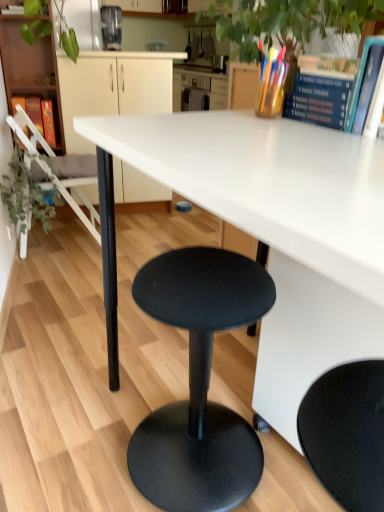
At what (x,y) coordinates should I click in order to perform the action: click on blue hardcover book at upper right, the 1th book viewed from the front. Please return your answer as a coordinate pair (x, y). The height and width of the screenshot is (512, 384). Looking at the image, I should click on (364, 84).

Find the location of a particular element. blue hardcover book at upper right, the second book in the front-to-back sequence is located at coordinates (318, 100).

The width and height of the screenshot is (384, 512). Identify the location of matte wood bookshelf at left. (30, 68).

You are a GUI agent. You are given a task and a screenshot of the screen. Output one action in this format:
    pyautogui.click(x=<x>, y=<y>)
    Task: Click on the hardcover book at left, acting as the first book starting from the top
    This screenshot has width=384, height=512.
    Given the screenshot: What is the action you would take?
    pyautogui.click(x=30, y=110)

Where is `satin silver coffee maker at upper left, the second appliance from the right`? satin silver coffee maker at upper left, the second appliance from the right is located at coordinates (85, 22).

Measure the distance between satin silver coffee maker at upper left, placed as the 1th appliance when sorted from left to right, and camera.

They are 8.23 feet apart.

The height and width of the screenshot is (512, 384). Find the location of `green leafy plant at left`. green leafy plant at left is located at coordinates (27, 196).

At what (x,y) coordinates should I click in order to perform the action: click on metallic gray coffee machine at upper center, which appears as the second appliance when viewed from the left. Please return your answer as a coordinate pair (x, y). This screenshot has width=384, height=512. Looking at the image, I should click on (111, 27).

Considering the relative sizes of metallic gray coffee machine at upper center, the first appliance in the right-to-left sequence, and white plastic chair at left in the image provided, is metallic gray coffee machine at upper center, the first appliance in the right-to-left sequence, smaller than white plastic chair at left?

Yes, metallic gray coffee machine at upper center, the first appliance in the right-to-left sequence, is smaller than white plastic chair at left.

Would you say metallic gray coffee machine at upper center, which appears as the second appliance when viewed from the left, is outside white plastic chair at left?

Yes, metallic gray coffee machine at upper center, which appears as the second appliance when viewed from the left, is outside of white plastic chair at left.

From the image's perspective, which one is positioned lower, metallic gray coffee machine at upper center, which appears as the second appliance when viewed from the left, or white plastic chair at left?

white plastic chair at left.

Can you tell me how much metallic gray coffee machine at upper center, the first appliance in the right-to-left sequence, and white plastic chair at left differ in facing direction?

The angular difference between metallic gray coffee machine at upper center, the first appliance in the right-to-left sequence, and white plastic chair at left is 1.62 degrees.

Can you confirm if satin silver coffee maker at upper left, placed as the 1th appliance when sorted from left to right, is bigger than white matte desk at center?

Incorrect, satin silver coffee maker at upper left, placed as the 1th appliance when sorted from left to right, is not larger than white matte desk at center.

Is satin silver coffee maker at upper left, the second appliance from the right, wider or thinner than white matte desk at center?

In the image, satin silver coffee maker at upper left, the second appliance from the right, appears to be more narrow than white matte desk at center.

Does satin silver coffee maker at upper left, the second appliance from the right, appear on the left side of white matte desk at center?

Yes.

Is point (71, 16) closer or farther from the camera than point (378, 298)?

Point (71, 16) is positioned farther from the camera compared to point (378, 298).

This screenshot has height=512, width=384. What are the coordinates of `plant that appears below the satin silver coffee maker at upper left, the second appliance from the right (from a real-world perspective)` in the screenshot? It's located at (27, 196).

Visually, is green leafy plant at left positioned to the left or to the right of satin silver coffee maker at upper left, the second appliance from the right?

From the image, it's evident that green leafy plant at left is to the left of satin silver coffee maker at upper left, the second appliance from the right.

From a real-world perspective, is green leafy plant at left located higher than satin silver coffee maker at upper left, placed as the 1th appliance when sorted from left to right?

No.

What's the angular difference between green leafy plant at left and satin silver coffee maker at upper left, placed as the 1th appliance when sorted from left to right,'s facing directions?

The angular difference between green leafy plant at left and satin silver coffee maker at upper left, placed as the 1th appliance when sorted from left to right, is 1.98 degrees.

Is metallic gray coffee machine at upper center, which appears as the second appliance when viewed from the left, completely or partially outside of blue hardcover book at upper right, which is the 2th book from back to front?

Yes, metallic gray coffee machine at upper center, which appears as the second appliance when viewed from the left, is not within blue hardcover book at upper right, which is the 2th book from back to front.

From a real-world perspective, is metallic gray coffee machine at upper center, which appears as the second appliance when viewed from the left, located beneath blue hardcover book at upper right, the second book in the front-to-back sequence?

Actually, metallic gray coffee machine at upper center, which appears as the second appliance when viewed from the left, is physically above blue hardcover book at upper right, the second book in the front-to-back sequence, in the real world.

Looking at the image, does metallic gray coffee machine at upper center, the first appliance in the right-to-left sequence, seem bigger or smaller compared to blue hardcover book at upper right, placed as the second book when sorted from left to right?

metallic gray coffee machine at upper center, the first appliance in the right-to-left sequence, is bigger than blue hardcover book at upper right, placed as the second book when sorted from left to right.

Where is `the 1st appliance counting from the left side of the blue hardcover book at upper right, the second book in the front-to-back sequence`? The height and width of the screenshot is (512, 384). the 1st appliance counting from the left side of the blue hardcover book at upper right, the second book in the front-to-back sequence is located at coordinates (111, 27).

Between blue hardcover book at upper right, the 2th book in the top-to-bottom sequence, and satin silver coffee maker at upper left, the second appliance from the right, which one has smaller width?

Thinner between the two is blue hardcover book at upper right, the 2th book in the top-to-bottom sequence.

Is blue hardcover book at upper right, which is the second book from bottom to top, in contact with satin silver coffee maker at upper left, the second appliance from the right?

No, blue hardcover book at upper right, which is the second book from bottom to top, is not touching satin silver coffee maker at upper left, the second appliance from the right.

From a real-world perspective, is blue hardcover book at upper right, the 2th book in the top-to-bottom sequence, above or below satin silver coffee maker at upper left, placed as the 1th appliance when sorted from left to right?

From a real-world perspective, blue hardcover book at upper right, the 2th book in the top-to-bottom sequence, is physically below satin silver coffee maker at upper left, placed as the 1th appliance when sorted from left to right.

Considering the relative sizes of blue hardcover book at upper right, which is counted as the first book, starting from the right, and satin silver coffee maker at upper left, placed as the 1th appliance when sorted from left to right, in the image provided, is blue hardcover book at upper right, which is counted as the first book, starting from the right, smaller than satin silver coffee maker at upper left, placed as the 1th appliance when sorted from left to right,?

Correct, blue hardcover book at upper right, which is counted as the first book, starting from the right, occupies less space than satin silver coffee maker at upper left, placed as the 1th appliance when sorted from left to right.

In terms of width, does matte wood bookshelf at left look wider or thinner when compared to satin silver coffee maker at upper left, the second appliance from the right?

Considering their sizes, matte wood bookshelf at left looks broader than satin silver coffee maker at upper left, the second appliance from the right.

Is matte wood bookshelf at left facing towards satin silver coffee maker at upper left, the second appliance from the right?

No.

Looking at this image, from a real-world perspective, is matte wood bookshelf at left physically above satin silver coffee maker at upper left, the second appliance from the right?

No.

Is matte wood bookshelf at left to the left or to the right of satin silver coffee maker at upper left, placed as the 1th appliance when sorted from left to right, in the image?

Clearly, matte wood bookshelf at left is on the left of satin silver coffee maker at upper left, placed as the 1th appliance when sorted from left to right, in the image.

Is metallic gray coffee machine at upper center, which appears as the second appliance when viewed from the left, with hardcover book at left, which is counted as the 3th book, starting from the right?

metallic gray coffee machine at upper center, which appears as the second appliance when viewed from the left, and hardcover book at left, which is counted as the 3th book, starting from the right, are not in contact.

Between metallic gray coffee machine at upper center, the first appliance in the right-to-left sequence, and hardcover book at left, which is the 3th book from front to back, which one is positioned behind?

hardcover book at left, which is the 3th book from front to back, is behind.

From a real-world perspective, is metallic gray coffee machine at upper center, the first appliance in the right-to-left sequence, physically below hardcover book at left, which is counted as the 3th book, starting from the right?

No, from a real-world perspective, metallic gray coffee machine at upper center, the first appliance in the right-to-left sequence, is not below hardcover book at left, which is counted as the 3th book, starting from the right.

Is metallic gray coffee machine at upper center, the first appliance in the right-to-left sequence, aimed at hardcover book at left, the 3th book in the bottom-to-top sequence?

No, metallic gray coffee machine at upper center, the first appliance in the right-to-left sequence, is not turned towards hardcover book at left, the 3th book in the bottom-to-top sequence.

The image size is (384, 512). There is a white plastic chair at left. Identify the location of the 1st appliance above it (from a real-world perspective). (111, 27).

The image size is (384, 512). What are the coordinates of `the 1st appliance behind the white matte desk at center` in the screenshot? It's located at (85, 22).

Based on their spatial positions, is white plastic chair at left or matte wood bookshelf at left further from blue hardcover book at upper right, which is counted as the first book, starting from the right?

matte wood bookshelf at left is further to blue hardcover book at upper right, which is counted as the first book, starting from the right.

When comparing their distances from hardcover book at left, acting as the first book starting from the top, does white plastic chair at left or matte wood bookshelf at left seem closer?

Among the two, matte wood bookshelf at left is located nearer to hardcover book at left, acting as the first book starting from the top.

Looking at the image, which one is located closer to green leafy plant at left, white matte cabinet at center or blue hardcover book at upper right, the 2th book in the top-to-bottom sequence?

white matte cabinet at center.

Which object lies further to the anchor point white plastic chair at left, blue hardcover book at upper right, the 1th book viewed from the front, or matte wood bookshelf at left?

blue hardcover book at upper right, the 1th book viewed from the front, is further to white plastic chair at left.

When comparing their distances from satin silver coffee maker at upper left, the second appliance from the right, does metallic gray coffee machine at upper center, the first appliance in the right-to-left sequence, or blue hardcover book at upper right, the 1th book viewed from the front, seem further?

blue hardcover book at upper right, the 1th book viewed from the front, is positioned further to the anchor satin silver coffee maker at upper left, the second appliance from the right.

When comparing their distances from white matte desk at center, does white matte cabinet at center or white plastic chair at left seem further?

The object further to white matte desk at center is white matte cabinet at center.

From the image, which object appears to be nearer to blue hardcover book at upper right, positioned as the 2th book in right-to-left order, white plastic chair at left or metallic gray coffee machine at upper center, which appears as the second appliance when viewed from the left?

The object closer to blue hardcover book at upper right, positioned as the 2th book in right-to-left order, is white plastic chair at left.

Estimate the real-world distances between objects in this image. Which object is closer to white matte cabinet at center, green leafy plant at left or white matte desk at center?

green leafy plant at left lies closer to white matte cabinet at center than the other object.

At what (x,y) coordinates should I click in order to perform the action: click on chair between blue hardcover book at upper right, which is counted as the third book, starting from the top, and hardcover book at left, which is the 3th book from front to back, along the z-axis. Please return your answer as a coordinate pair (x, y). The image size is (384, 512). Looking at the image, I should click on (59, 169).

You are a GUI agent. You are given a task and a screenshot of the screen. Output one action in this format:
    pyautogui.click(x=<x>, y=<y>)
    Task: Click on the book positioned between blue hardcover book at upper right, the 1th book viewed from the front, and white matte cabinet at center from near to far
    This screenshot has width=384, height=512.
    Given the screenshot: What is the action you would take?
    pyautogui.click(x=318, y=100)

Locate an element on the screen. Image resolution: width=384 pixels, height=512 pixels. bookshelf that lies between metallic gray coffee machine at upper center, which appears as the second appliance when viewed from the left, and green leafy plant at left from top to bottom is located at coordinates (30, 68).

The width and height of the screenshot is (384, 512). In order to click on cabinetry between blue hardcover book at upper right, the second book in the front-to-back sequence, and hardcover book at left, which appears as the 1th book when viewed from the left, from front to back in this screenshot , I will do `click(113, 88)`.